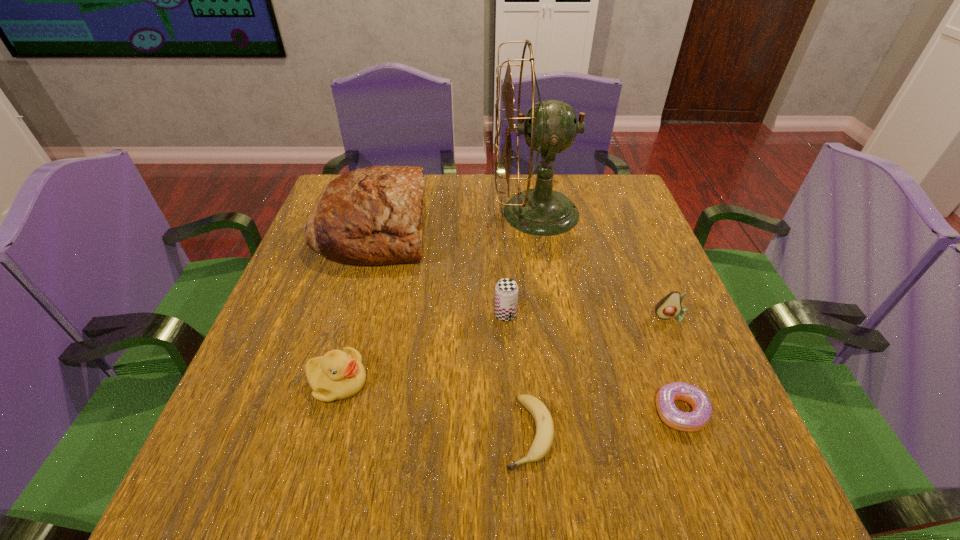
The image size is (960, 540). Identify the location of the tallest object. (550, 127).

Locate an element on the screen. the sixth shortest object is located at coordinates (370, 216).

Image resolution: width=960 pixels, height=540 pixels. Identify the location of beer can. (506, 290).

What are the coordinates of `avocado` in the screenshot? It's located at (668, 307).

Identify the location of duckling. This screenshot has height=540, width=960. (338, 375).

At what (x,y) coordinates should I click in order to perform the action: click on the sixth tallest object. Please return your answer as a coordinate pair (x, y). The height and width of the screenshot is (540, 960). Looking at the image, I should click on (696, 420).

You are a GUI agent. You are given a task and a screenshot of the screen. Output one action in this format:
    pyautogui.click(x=<x>, y=<y>)
    Task: Click on the banana
    
    Given the screenshot: What is the action you would take?
    pyautogui.click(x=544, y=435)

Where is `free spot located in front of the tallest object, directing air flow`? The width and height of the screenshot is (960, 540). free spot located in front of the tallest object, directing air flow is located at coordinates (372, 213).

Locate an element on the screen. The width and height of the screenshot is (960, 540). free point located 0.390m in front of the tallest object, directing air flow is located at coordinates (353, 213).

Image resolution: width=960 pixels, height=540 pixels. What are the coordinates of `vacant space located in front of the tallest object, directing air flow` in the screenshot? It's located at (396, 213).